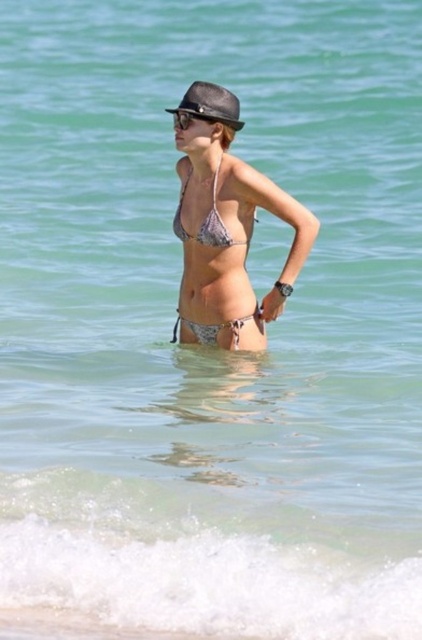
In the scene shown: You are a photographer trying to capture the person in the scene. You need to decide which object, the shiny black baseball hat at center or the black matte goggles at upper center, will appear larger in your photo. Which one will be larger?

The shiny black baseball hat at center is taller than black matte goggles at upper center, so it will appear larger in the photo.

You are a fashion designer observing the beach scene. You notice the metallic bikini at center and the silver metallic bikini top at center. Which one has a taller silhouette?

The metallic bikini at center has a greater height compared to the silver metallic bikini top at center, so the metallic bikini at center has a taller silhouette.

You are a photographer trying to capture the perfect shot of the purple floral bikini at center and the shiny black baseball hat at center. From which side of the person should you position yourself to have both objects visible in the frame?

To capture both the purple floral bikini at center and the shiny black baseball hat at center in the frame, position yourself to the right side of the person since the purple floral bikini at center is to the left of the shiny black baseball hat at center.